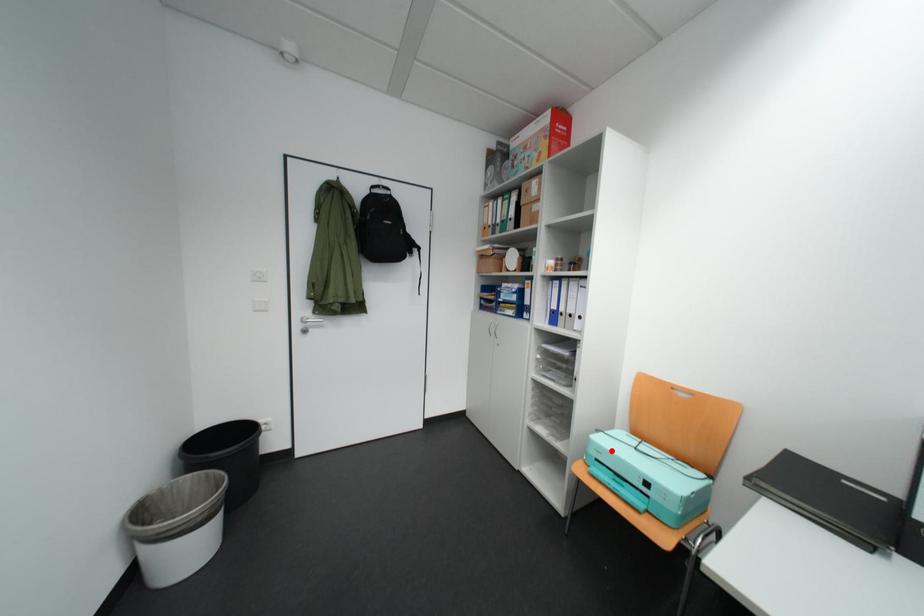
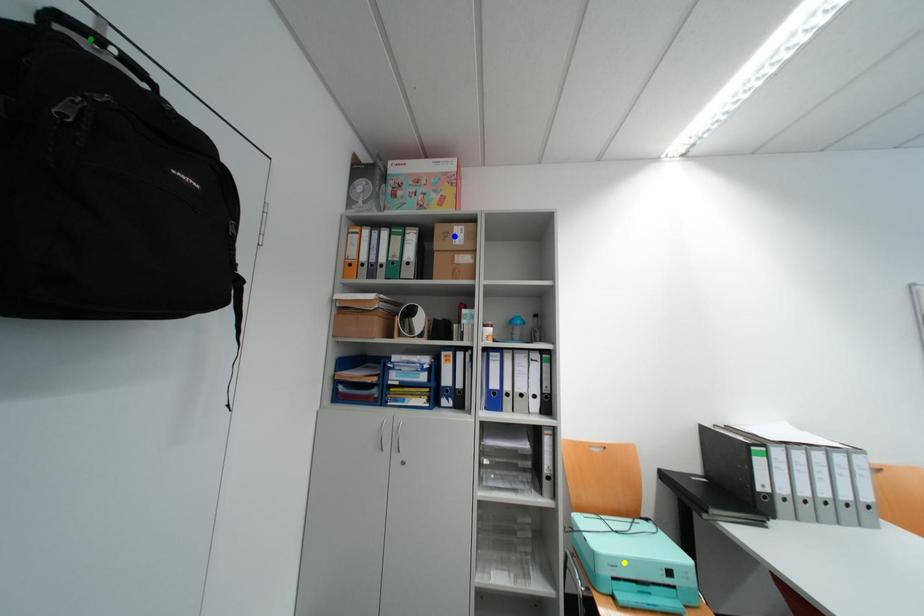
Question: I am providing you with two images of the same scene from different viewpoints. A red point is marked on the first image. You are given multiple points on the second image. Can you choose the point in image 2 that corresponds to the point in image 1?

Choices:
 (A) yellow point
 (B) green point
 (C) blue point

Answer: (A)